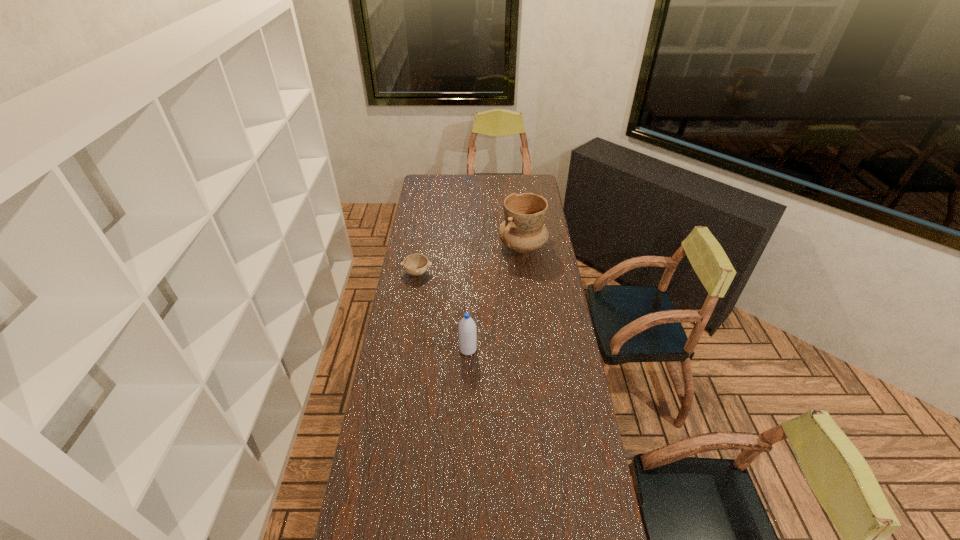
This screenshot has width=960, height=540. Identify the location of free spot between the second tallest object and the shortest object. (443, 311).

You are a GUI agent. You are given a task and a screenshot of the screen. Output one action in this format:
    pyautogui.click(x=<x>, y=<y>)
    Task: Click on the free spot between the nearest object and the rightmost object
    The height and width of the screenshot is (540, 960).
    Given the screenshot: What is the action you would take?
    pyautogui.click(x=495, y=298)

Find the location of `object that is the closest to the pottery`. object that is the closest to the pottery is located at coordinates (416, 264).

Select which object appears as the closest to the second object from left to right. Please provide its 2D coordinates. Your answer should be formatted as a tuple, i.e. [(x, y)], where the tuple contains the x and y coordinates of a point satisfying the conditions above.

[(416, 264)]